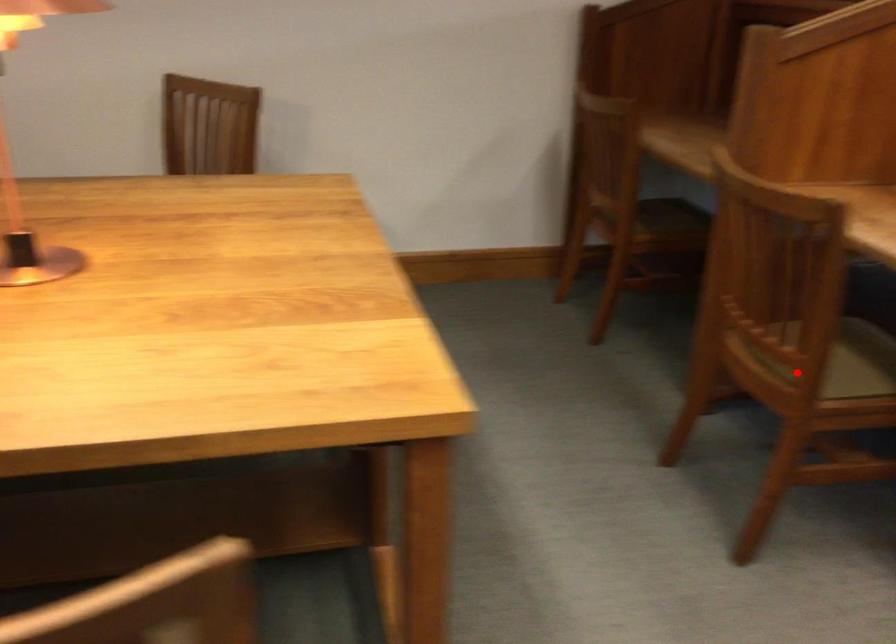
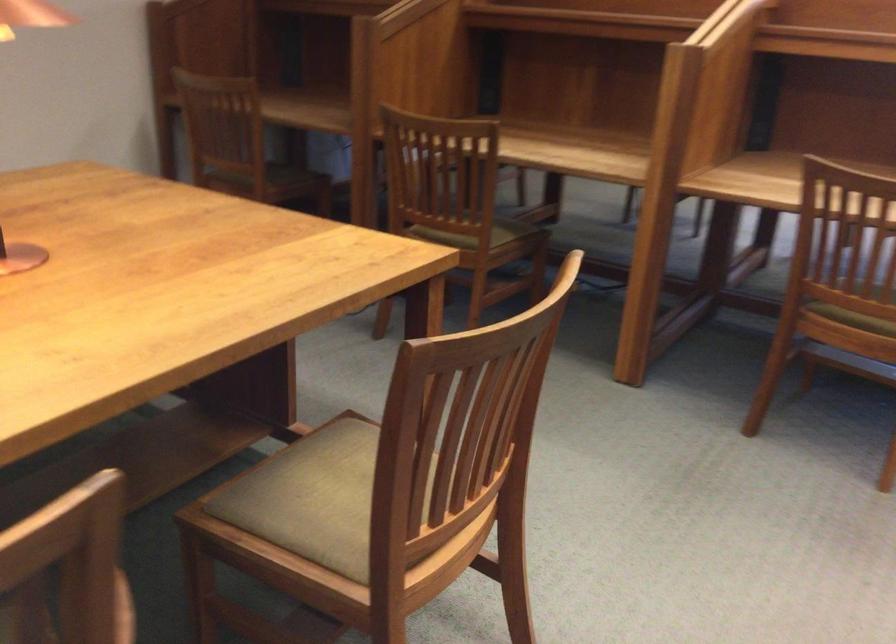
Question: I am providing you with two images of the same scene from different viewpoints. A red point is marked on the first image. Is the red point's position out of view in image 2?

Choices:
 (A) Yes
 (B) No

Answer: (B)